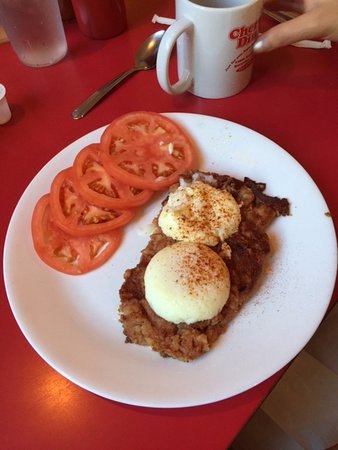
In order to click on table in this screenshot , I will do `click(277, 127)`.